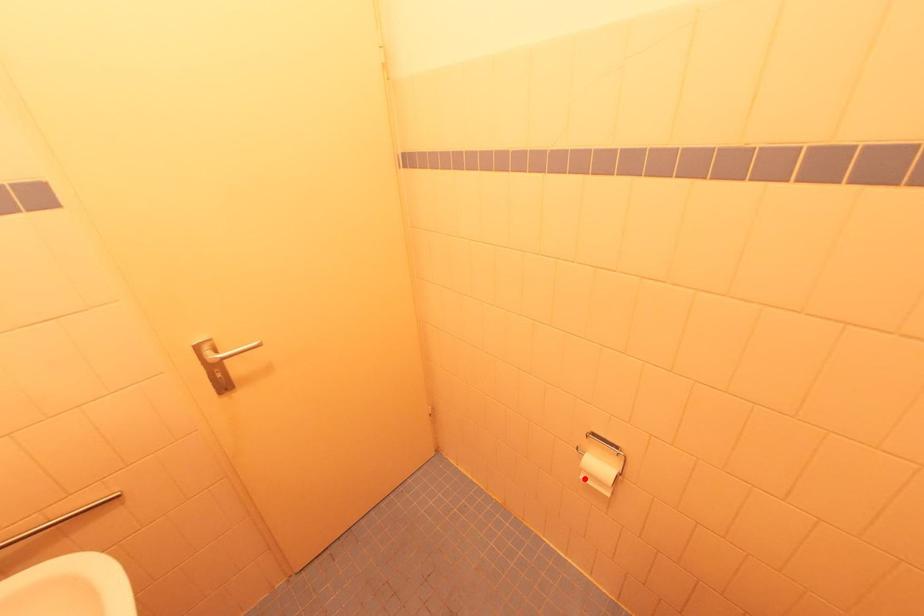
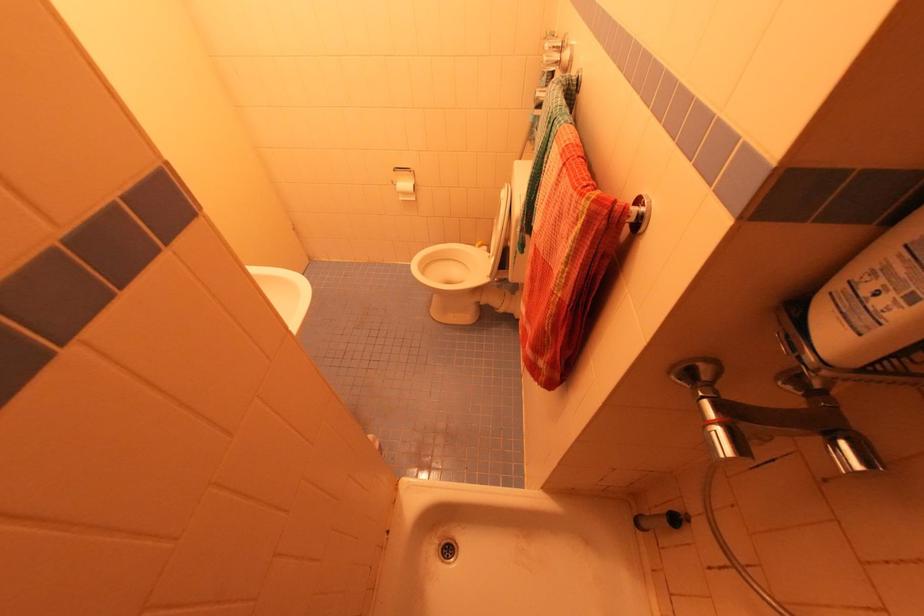
Question: A red point is marked in image1. In image2, is the corresponding 3D point closer to the camera or farther? Reply with the corresponding letter.

Choices:
 (A) The corresponding 3D point is closer.
 (B) The corresponding 3D point is farther.

Answer: (A)